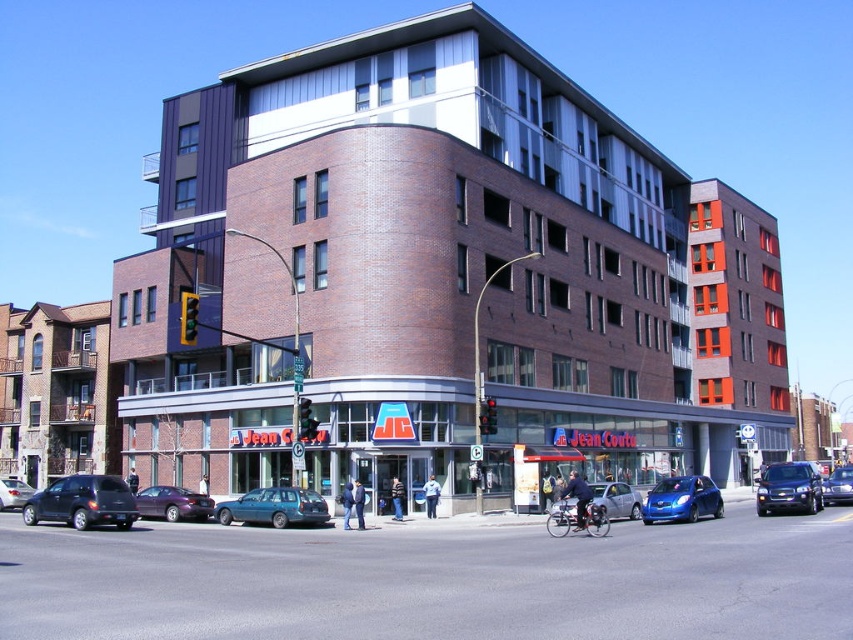
Describe the element at coordinates (274, 508) in the screenshot. The width and height of the screenshot is (853, 640). I see `teal matte station wagon at center` at that location.

Can you confirm if teal matte station wagon at center is positioned below metallic blue suv at center?

No, teal matte station wagon at center is not below metallic blue suv at center.

Which is in front, point (276, 502) or point (786, 492)?

Positioned in front is point (786, 492).

Identify the location of teal matte station wagon at center. This screenshot has width=853, height=640. (274, 508).

Can you confirm if matte black suv at lower left is taller than matte black sedan at center?

Correct, matte black suv at lower left is much taller as matte black sedan at center.

Between matte black suv at lower left and matte black sedan at center, which one has less height?

Standing shorter between the two is matte black sedan at center.

What do you see at coordinates (82, 502) in the screenshot?
I see `matte black suv at lower left` at bounding box center [82, 502].

At what (x,y) coordinates should I click in order to perform the action: click on matte black suv at lower left. Please return your answer as a coordinate pair (x, y). Looking at the image, I should click on (82, 502).

Is matte black suv at lower left positioned in front of shiny silver sedan at center?

Yes, matte black suv at lower left is in front of shiny silver sedan at center.

Can you confirm if matte black suv at lower left is positioned below shiny silver sedan at center?

Correct, matte black suv at lower left is located below shiny silver sedan at center.

Which is in front, point (48, 497) or point (828, 490)?

Point (48, 497) is more forward.

Find the location of a particular element. matte black suv at lower left is located at coordinates (82, 502).